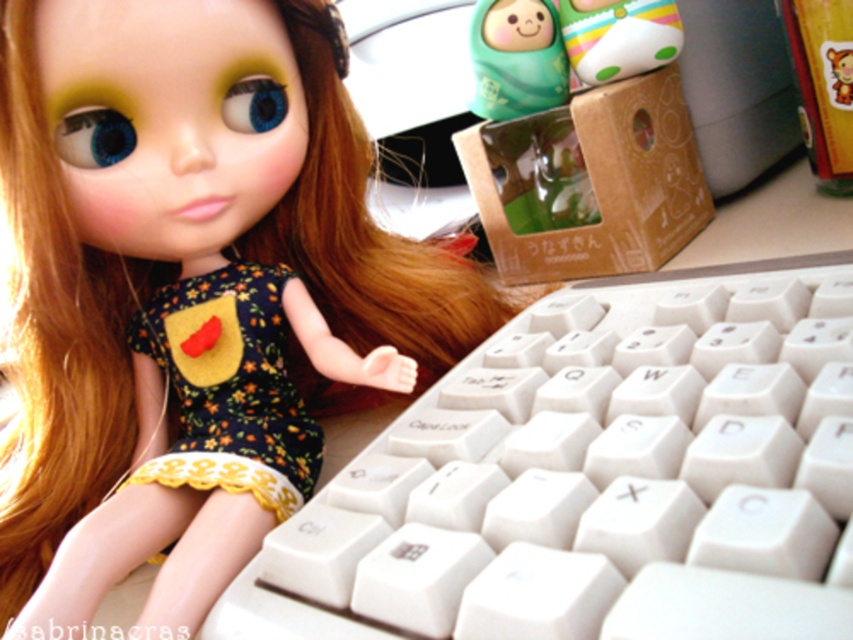
Question: Estimate the real-world distances between objects in this image. Which object is closer to the matte plastic toy at upper center?

Choices:
 (A) white plastic keyboard at center
 (B) matte black doll at upper left
 (C) smooth green figurine at upper center

Answer: (C)

Question: Does floral fabric dress at center appear on the right side of smooth green figurine at upper center?

Choices:
 (A) yes
 (B) no

Answer: (B)

Question: Which point is farther to the camera?

Choices:
 (A) [x=625, y=602]
 (B) [x=209, y=400]
 (C) [x=608, y=68]

Answer: (C)

Question: Can you confirm if floral fabric dress at center is positioned above smooth green figurine at upper center?

Choices:
 (A) no
 (B) yes

Answer: (A)

Question: Does white plastic keyboard at center have a smaller size compared to smooth green figurine at upper center?

Choices:
 (A) yes
 (B) no

Answer: (B)

Question: Among these objects, which one is nearest to the camera?

Choices:
 (A) matte black doll at upper left
 (B) white plastic keyboard at center
 (C) floral fabric dress at center

Answer: (B)